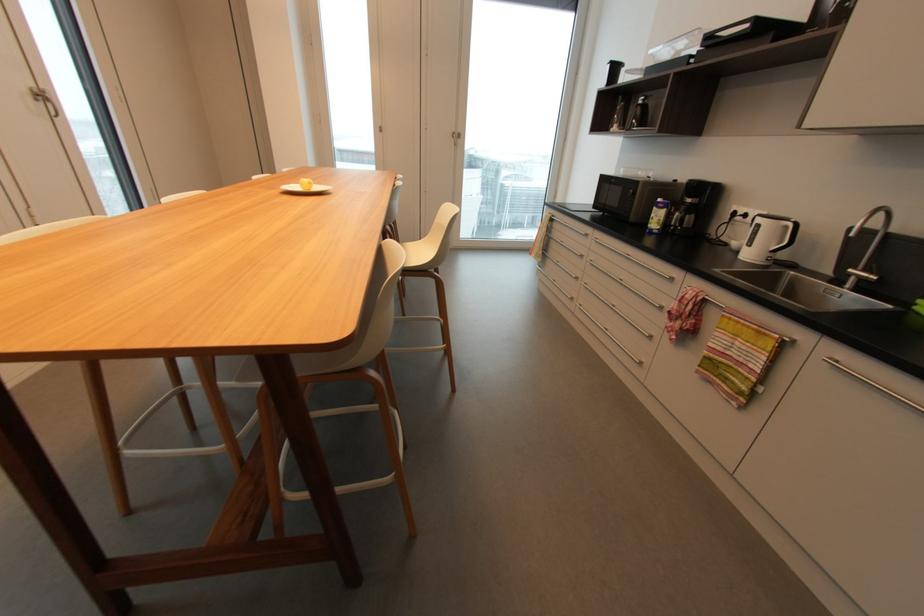
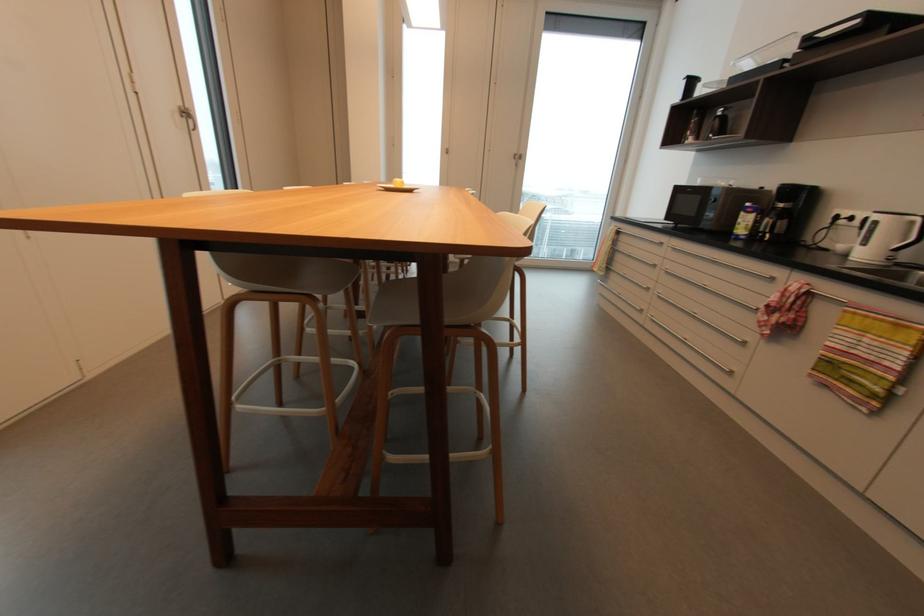
Question: The first image is from the beginning of the video and the second image is from the end. How did the camera likely rotate when shooting the video?

Choices:
 (A) Left
 (B) Right
 (C) Up
 (D) Down

Answer: (A)